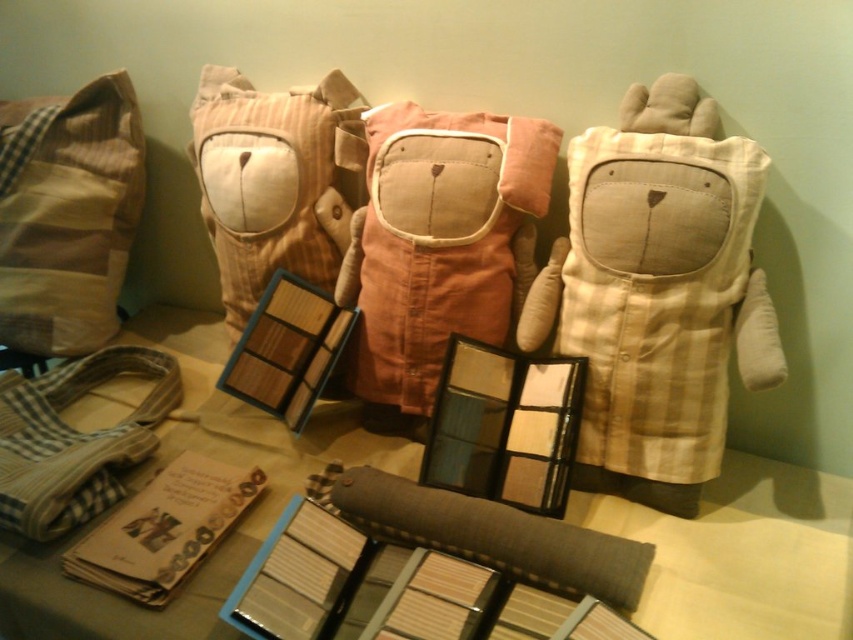
Does point (540, 132) come farther from viewer compared to point (294, 161)?

That is False.

Is point (506, 321) closer to camera compared to point (305, 118)?

Yes.

Where is `matte orange fabric bag at center`? This screenshot has height=640, width=853. matte orange fabric bag at center is located at coordinates [439, 243].

Who is more distant from viewer, [260,122] or [431,492]?

Positioned behind is point [260,122].

Who is more forward, (219,131) or (498,566)?

Point (498,566) is in front.

Identify the location of striped fabric pillow at center. The image size is (853, 640). (270, 180).

Who is shorter, checkered fabric bag at lower left or brown textured pillow at center?

With less height is brown textured pillow at center.

Which is more to the left, checkered fabric bag at lower left or brown textured pillow at center?

checkered fabric bag at lower left is more to the left.

Is point (74, 442) farther from viewer compared to point (387, 515)?

Yes, it is behind point (387, 515).

Find the location of a particular element. The height and width of the screenshot is (640, 853). checkered fabric bag at lower left is located at coordinates (74, 440).